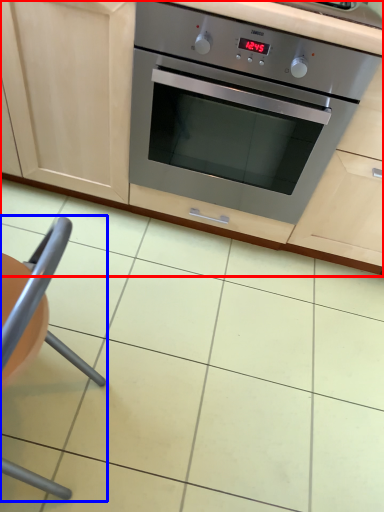
Question: Which object appears closest to the camera in this image, cabinetry (highlighted by a red box) or armchair (highlighted by a blue box)?

Choices:
 (A) cabinetry
 (B) armchair

Answer: (B)